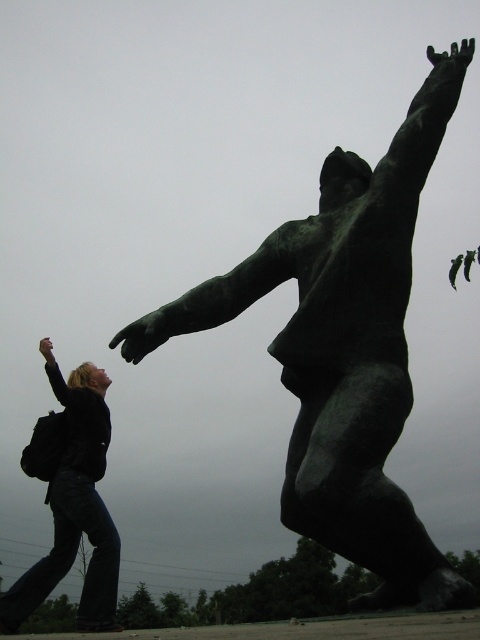
You are a photographer trying to capture the interaction between the green patina bronze statue at center and the dark blue jeans at lower left. Since the statue is in front of the person, will you position yourself behind the statue or behind the person to ensure both are visible in the frame?

Since the green patina bronze statue at center is in front of the dark blue jeans at lower left, positioning yourself behind the statue would allow both the statue and the person to be visible in the frame. If you stand behind the person, the statue might block the view of the person.

You are standing at the camera position and want to take a photo of the green patina bronze statue at center. If your camera can focus up to 10 meters, will it be able to capture the statue clearly?

The green patina bronze statue at center is 9.41 meters away from the camera. Since the camera can focus up to 10 meters, it will be able to capture the statue clearly.